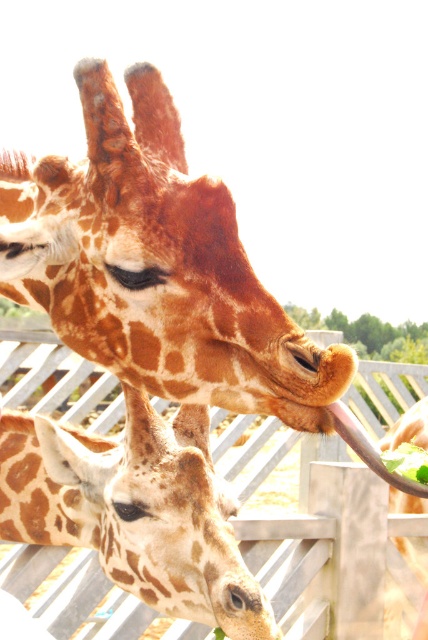
Which is more to the left, spotted fur giraffe at center or green leafy food at lower right?

spotted fur giraffe at center

Looking at this image, who is lower down, spotted fur giraffe at center or green leafy food at lower right?

spotted fur giraffe at center is below.

This screenshot has width=428, height=640. Describe the element at coordinates (136, 509) in the screenshot. I see `spotted fur giraffe at center` at that location.

Where is `spotted fur giraffe at center`? The width and height of the screenshot is (428, 640). spotted fur giraffe at center is located at coordinates (136, 509).